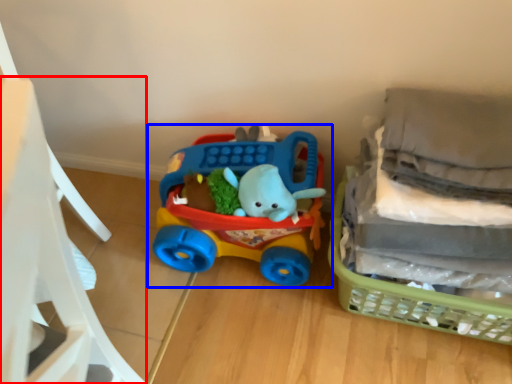
Question: Among these objects, which one is farthest to the camera, chair (highlighted by a red box) or toy (highlighted by a blue box)?

Choices:
 (A) chair
 (B) toy

Answer: (B)